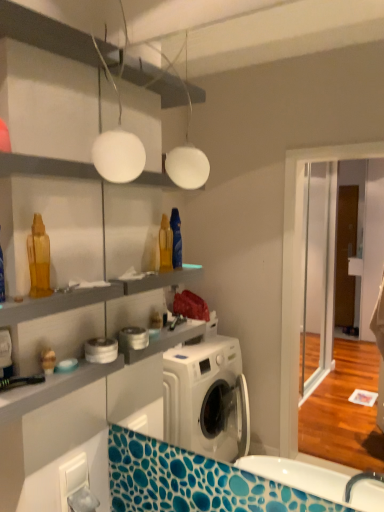
Question: Can you confirm if white glossy shelf at upper center is shorter than matte plastic toy at lower left?

Choices:
 (A) no
 (B) yes

Answer: (B)

Question: Does white glossy shelf at upper center have a greater width compared to matte plastic toy at lower left?

Choices:
 (A) no
 (B) yes

Answer: (B)

Question: From a real-world perspective, is white glossy shelf at upper center over matte plastic toy at lower left?

Choices:
 (A) yes
 (B) no

Answer: (A)

Question: Is white glossy shelf at upper center in front of matte plastic toy at lower left?

Choices:
 (A) no
 (B) yes

Answer: (B)

Question: Considering the relative sizes of white glossy shelf at upper center and matte plastic toy at lower left in the image provided, is white glossy shelf at upper center bigger than matte plastic toy at lower left?

Choices:
 (A) yes
 (B) no

Answer: (A)

Question: Is white glossy shelf at upper center wider or thinner than matte plastic toy at lower left?

Choices:
 (A) thin
 (B) wide

Answer: (B)

Question: In the image, is white glossy shelf at upper center on the left side or the right side of matte plastic toy at lower left?

Choices:
 (A) left
 (B) right

Answer: (A)

Question: In the image, is white glossy shelf at upper center positioned in front of or behind matte plastic toy at lower left?

Choices:
 (A) behind
 (B) front

Answer: (B)

Question: Considering the positions of white glossy shelf at upper center and matte plastic toy at lower left in the image, is white glossy shelf at upper center taller or shorter than matte plastic toy at lower left?

Choices:
 (A) tall
 (B) short

Answer: (B)

Question: Is matte plastic toy at lower left taller or shorter than white glossy shelf at upper center?

Choices:
 (A) short
 (B) tall

Answer: (B)

Question: From the image's perspective, is matte plastic toy at lower left positioned above or below white glossy shelf at upper center?

Choices:
 (A) below
 (B) above

Answer: (A)

Question: Is matte plastic toy at lower left situated inside white glossy shelf at upper center or outside?

Choices:
 (A) inside
 (B) outside

Answer: (B)

Question: Is matte plastic toy at lower left to the left or to the right of white glossy shelf at upper center in the image?

Choices:
 (A) right
 (B) left

Answer: (A)

Question: Based on their sizes in the image, would you say white matte globe at upper center is bigger or smaller than white glossy shelf at upper center?

Choices:
 (A) small
 (B) big

Answer: (A)

Question: In terms of height, does white matte globe at upper center look taller or shorter compared to white glossy shelf at upper center?

Choices:
 (A) tall
 (B) short

Answer: (A)